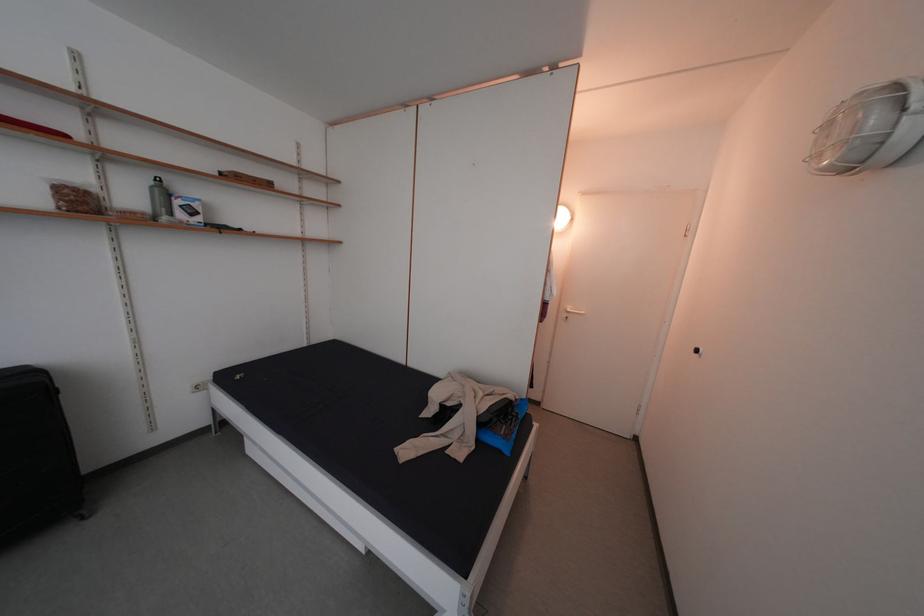
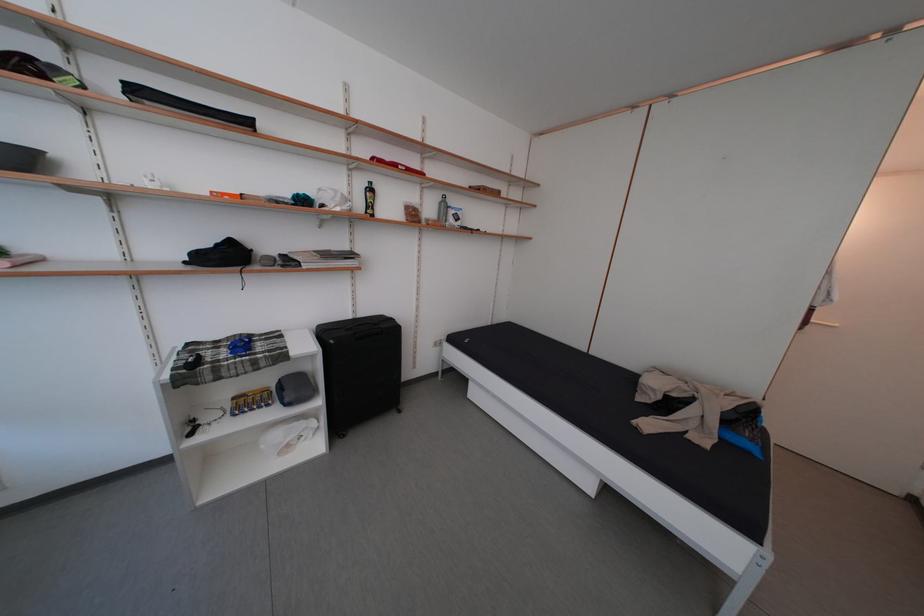
Question: The images are taken continuously from a first-person perspective. In which direction is your viewpoint rotating?

Choices:
 (A) Left
 (B) Right
 (C) Up
 (D) Down

Answer: (A)